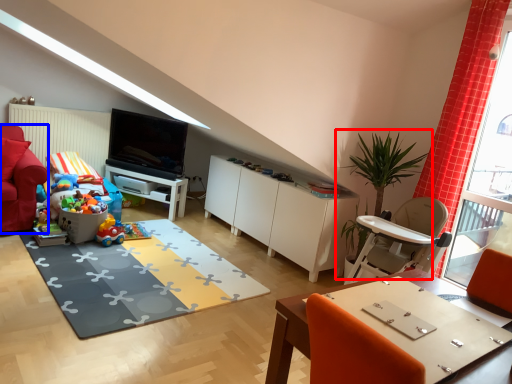
Question: Among these objects, which one is farthest to the camera, houseplant (highlighted by a red box) or armchair (highlighted by a blue box)?

Choices:
 (A) houseplant
 (B) armchair

Answer: (B)